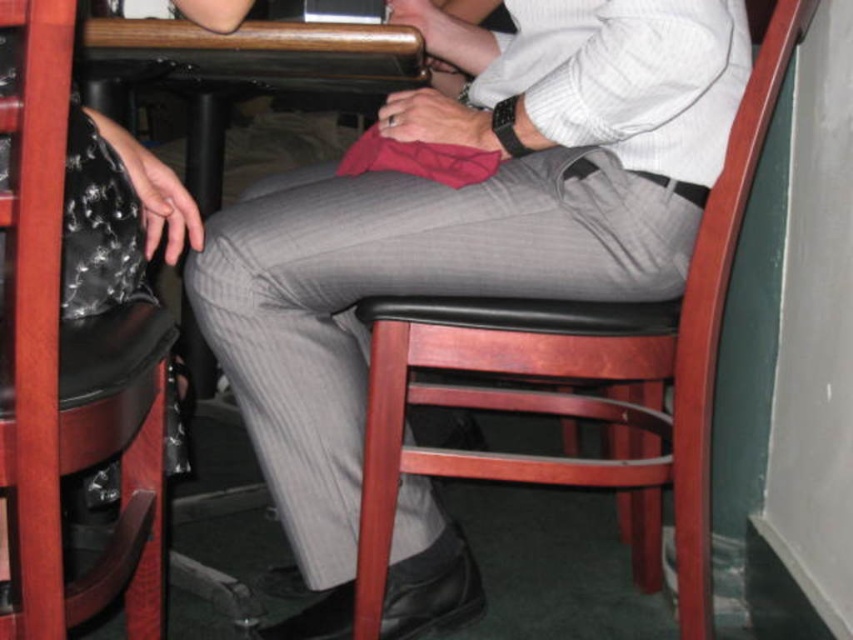
Question: Estimate the real-world distances between objects in this image. Which object is closer to the black leather chair at center?

Choices:
 (A) wooden table at center
 (B) wooden chair at center

Answer: (B)

Question: Can you confirm if black leather chair at center is smaller than wooden table at center?

Choices:
 (A) yes
 (B) no

Answer: (B)

Question: Which object is closer to the camera taking this photo?

Choices:
 (A) wooden table at center
 (B) black leather chair at center
 (C) wooden chair at center

Answer: (B)

Question: Does black leather chair at center appear under wooden table at center?

Choices:
 (A) yes
 (B) no

Answer: (A)

Question: Which point is closer to the camera?

Choices:
 (A) (100, 400)
 (B) (581, 333)
 (C) (91, 26)

Answer: (A)

Question: Considering the relative positions of wooden chair at center and wooden table at center in the image provided, where is wooden chair at center located with respect to wooden table at center?

Choices:
 (A) right
 (B) left

Answer: (A)